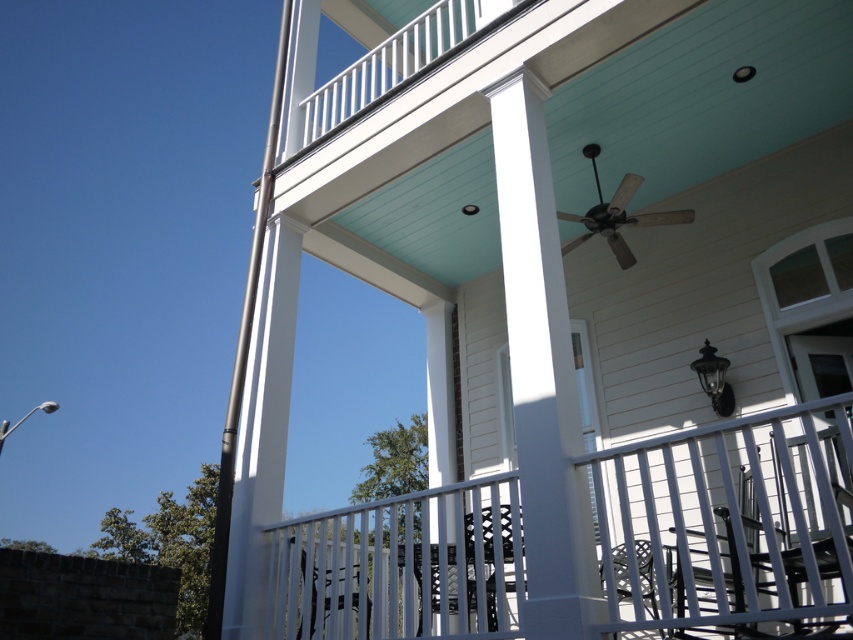
Describe the element at coordinates (727, 528) in the screenshot. I see `white metal railing at lower center` at that location.

Which is in front, point (779, 595) or point (527, 595)?

Positioned in front is point (779, 595).

Describe the element at coordinates (727, 528) in the screenshot. I see `white metal railing at lower center` at that location.

The image size is (853, 640). What are the coordinates of `white metal railing at lower center` in the screenshot? It's located at (727, 528).